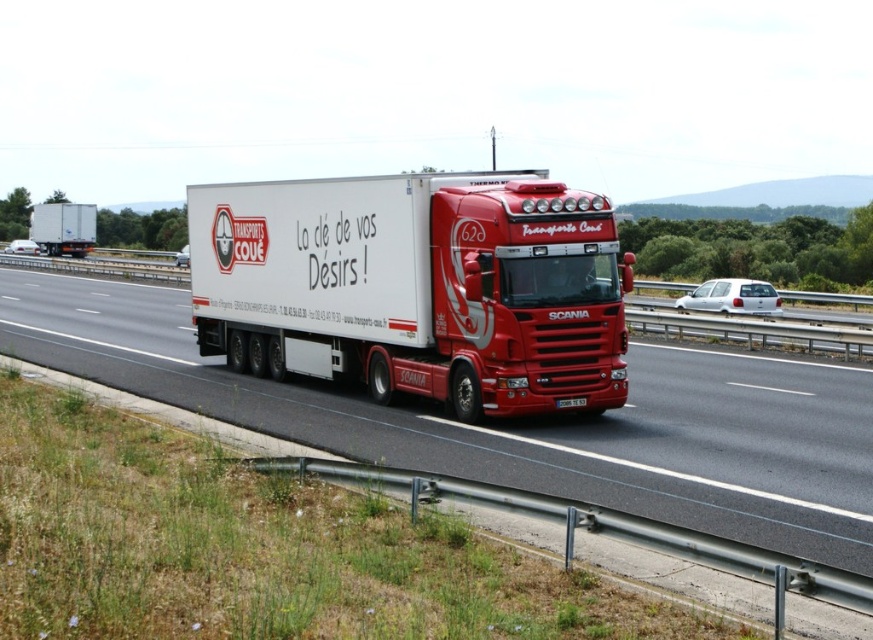
You are a GPS navigator and need to determine the current position of the white matte trailer truck at center on the map. What are its coordinates?

The white matte trailer truck at center is located at coordinates (416,285).

You are a passenger in the red Scania truck and want to know which of the two points, point (x=50, y=232) or point (x=562, y=406), is closer to you. Based on the scene description, which point is nearer?

Point (x=50, y=232) is closer to you because it is further to the viewer than point (x=562, y=406).